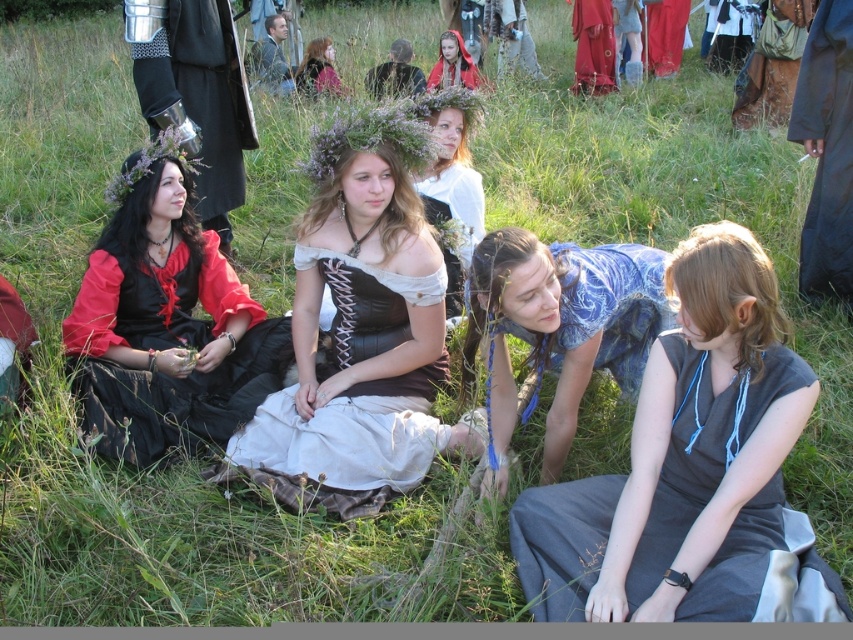
Question: Can you confirm if blue fabric dress at center is thinner than metallic armor at left?

Choices:
 (A) no
 (B) yes

Answer: (A)

Question: Considering the real-world distances, which object is farthest from the gray fabric dress at lower right?

Choices:
 (A) white lace dress at center
 (B) matte red skirt at upper right

Answer: (B)

Question: Does gray fabric dress at lower right appear over rusty metal armor at upper right?

Choices:
 (A) yes
 (B) no

Answer: (B)

Question: Which object is closer to the camera taking this photo?

Choices:
 (A) brown leather belt at center
 (B) rusty metal armor at upper right

Answer: (B)

Question: Does gray fabric dress at lower right come in front of matte black dress at left?

Choices:
 (A) no
 (B) yes

Answer: (B)

Question: Which point appears closest to the camera in this image?

Choices:
 (A) coord(821,42)
 (B) coord(746,29)

Answer: (A)